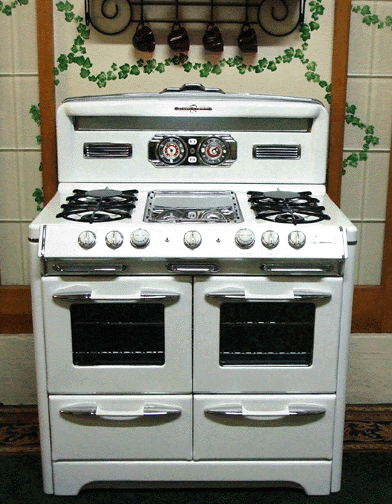
Locate an element on the screen. knobs on stove is located at coordinates (91, 244), (119, 241), (136, 239), (189, 238), (244, 240), (271, 238), (296, 239).